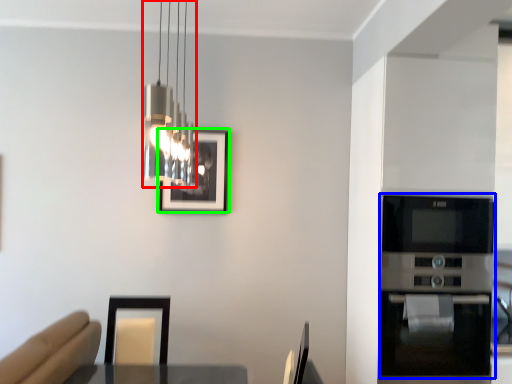
Question: Which is nearer to the lamp (highlighted by a red box)? appliance (highlighted by a blue box) or picture frame (highlighted by a green box).

Choices:
 (A) appliance
 (B) picture frame

Answer: (B)